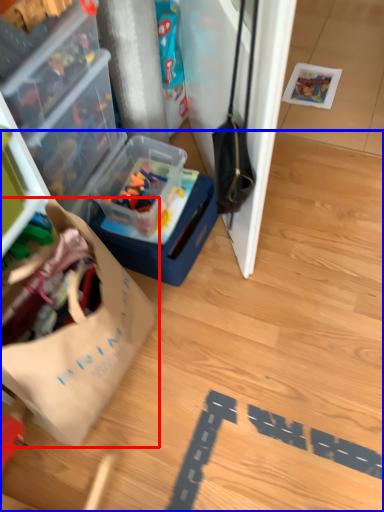
Question: Which point is further to the camera, wrapping paper (highlighted by a red box) or wood (highlighted by a blue box)?

Choices:
 (A) wrapping paper
 (B) wood

Answer: (B)